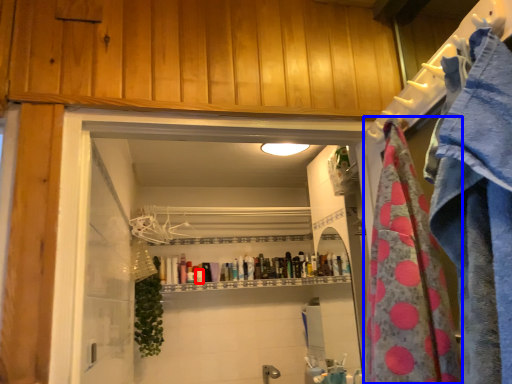
Question: Which point is further to the camera, toiletry (highlighted by a red box) or beach towel (highlighted by a blue box)?

Choices:
 (A) toiletry
 (B) beach towel

Answer: (A)